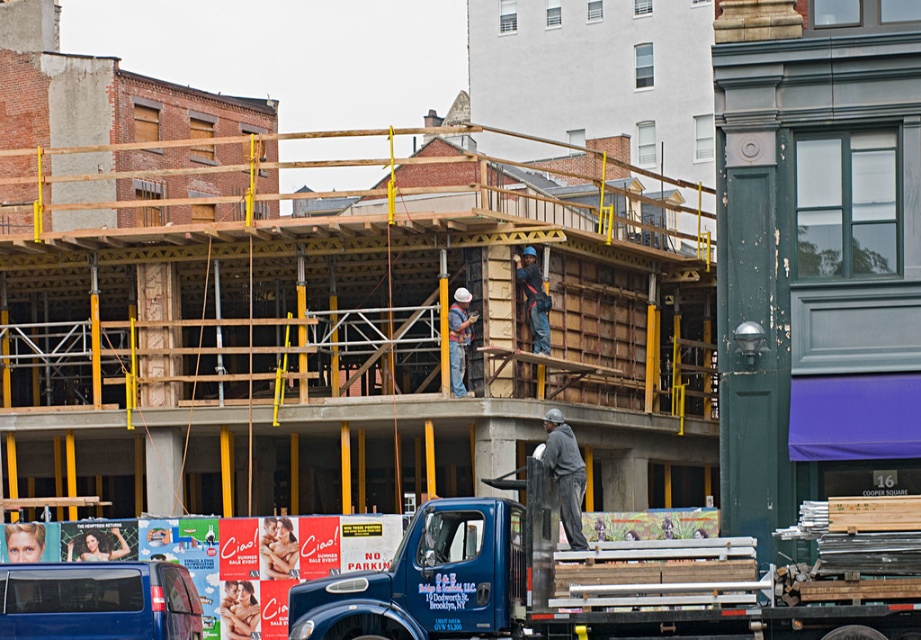
Question: Estimate the real-world distances between objects in this image. Which object is farther from the matte gray hard hat at center?

Choices:
 (A) dark gray fabric jacket at center
 (B) blue matte truck at center

Answer: (B)

Question: Is dark gray fabric jacket at center wider than matte gray hard hat at center?

Choices:
 (A) no
 (B) yes

Answer: (B)

Question: Is blue metallic truck at center to the left of blue matte truck at center from the viewer's perspective?

Choices:
 (A) yes
 (B) no

Answer: (B)

Question: Based on their relative distances, which object is farther from the blue matte truck at center?

Choices:
 (A) blue metallic truck at center
 (B) matte gray hard hat at center
 (C) dark gray fabric jacket at center

Answer: (B)

Question: Which object is closer to the camera taking this photo?

Choices:
 (A) blue metallic truck at center
 (B) blue matte truck at center
 (C) matte gray hard hat at center

Answer: (A)

Question: Can you confirm if blue matte truck at center is positioned above dark gray fabric jacket at center?

Choices:
 (A) yes
 (B) no

Answer: (B)